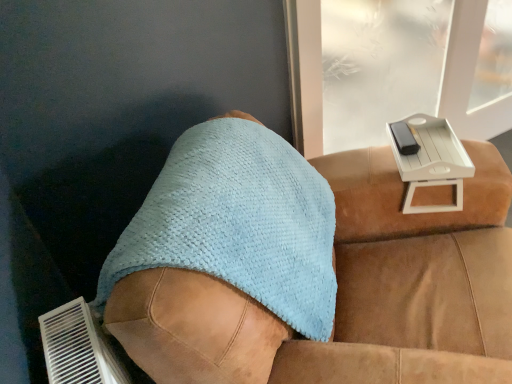
What is the approximate width of white plastic tray at upper right?

8.60 inches.

Measure the distance between light blue textured towel at center and camera.

light blue textured towel at center and camera are 32.70 inches apart from each other.

Locate an element on the screen. The width and height of the screenshot is (512, 384). light blue textured towel at center is located at coordinates (238, 223).

What is the approximate width of light brown leather couch at center?

It is 3.33 feet.

This screenshot has height=384, width=512. Identify the location of white plastic tray at upper right. (431, 160).

Which object is closer to the camera, light blue textured towel at center or white plastic tray at upper right?

Positioned in front is light blue textured towel at center.

This screenshot has height=384, width=512. Find the location of `table that is on the right side of light blue textured towel at center`. table that is on the right side of light blue textured towel at center is located at coordinates (431, 160).

Does light blue textured towel at center have a lesser width compared to white plastic tray at upper right?

No, light blue textured towel at center is not thinner than white plastic tray at upper right.

Is light blue textured towel at center touching white plastic tray at upper right?

light blue textured towel at center and white plastic tray at upper right are clearly separated.

Does light blue textured towel at center have a greater height compared to light brown leather couch at center?

In fact, light blue textured towel at center may be shorter than light brown leather couch at center.

Does point (226, 254) lie in front of point (492, 315)?

Yes, point (226, 254) is closer to viewer.

What's the angular difference between light blue textured towel at center and light brown leather couch at center's facing directions?

They differ by 0.0215 degrees in their facing directions.

Consider the image. Could you tell me if white plastic tray at upper right is facing light brown leather couch at center?

Yes, white plastic tray at upper right is aimed at light brown leather couch at center.

Is white plastic tray at upper right directly adjacent to light brown leather couch at center?

No, white plastic tray at upper right is not in contact with light brown leather couch at center.

Can you confirm if white plastic tray at upper right is smaller than light brown leather couch at center?

Yes, white plastic tray at upper right is smaller than light brown leather couch at center.

From a real-world perspective, which is physically below, white plastic tray at upper right or light brown leather couch at center?

light brown leather couch at center is physically lower.

Are light brown leather couch at center and light blue textured towel at center far apart?

No, light brown leather couch at center is in close proximity to light blue textured towel at center.

Is light brown leather couch at center completely or partially outside of light blue textured towel at center?

Yes.

Which of these two, light brown leather couch at center or light blue textured towel at center, stands shorter?

Standing shorter between the two is light blue textured towel at center.

Could you tell me if light brown leather couch at center is facing light blue textured towel at center?

No, light brown leather couch at center is not turned towards light blue textured towel at center.

From the image's perspective, is white plastic tray at upper right located above or below light blue textured towel at center?

white plastic tray at upper right is situated higher than light blue textured towel at center in the image.

Does white plastic tray at upper right have a greater width compared to light blue textured towel at center?

Incorrect, the width of white plastic tray at upper right does not surpass that of light blue textured towel at center.

How many degrees apart are the facing directions of white plastic tray at upper right and light blue textured towel at center?

3.52 degrees.

From a real-world perspective, which object stands above the other?

From a 3D spatial view, light blue textured towel at center is above.

Is point (138, 236) in front of point (460, 155)?

Yes, point (138, 236) is closer to viewer.

Considering the positions of objects light brown leather couch at center and white plastic tray at upper right in the image provided, who is more to the left, light brown leather couch at center or white plastic tray at upper right?

light brown leather couch at center.

Between light brown leather couch at center and white plastic tray at upper right, which one has more height?

light brown leather couch at center is taller.

Considering the positions of objects light brown leather couch at center and white plastic tray at upper right in the image provided, who is in front, light brown leather couch at center or white plastic tray at upper right?

light brown leather couch at center is closer to the camera.

Identify the location of table beneath the light blue textured towel at center (from a real-world perspective). (431, 160).

In order to click on throw pillow that appears above the light brown leather couch at center (from a real-world perspective) in this screenshot , I will do `click(238, 223)`.

When comparing their distances from light brown leather couch at center, does white plastic tray at upper right or light blue textured towel at center seem further?

white plastic tray at upper right is further to light brown leather couch at center.

Based on their spatial positions, is light brown leather couch at center or white plastic tray at upper right further from light blue textured towel at center?

Based on the image, white plastic tray at upper right appears to be further to light blue textured towel at center.

When comparing their distances from light brown leather couch at center, does light blue textured towel at center or white plastic tray at upper right seem further?

Based on the image, white plastic tray at upper right appears to be further to light brown leather couch at center.

From the image, which object appears to be nearer to white plastic tray at upper right, light brown leather couch at center or light blue textured towel at center?

light brown leather couch at center lies closer to white plastic tray at upper right than the other object.

Looking at the image, which one is located closer to white plastic tray at upper right, light blue textured towel at center or light brown leather couch at center?

Based on the image, light brown leather couch at center appears to be nearer to white plastic tray at upper right.

From the image, which object appears to be farther from light blue textured towel at center, white plastic tray at upper right or light brown leather couch at center?

The object further to light blue textured towel at center is white plastic tray at upper right.

Find the location of a particular element. The height and width of the screenshot is (384, 512). throw pillow between light brown leather couch at center and white plastic tray at upper right in the front-back direction is located at coordinates (238, 223).